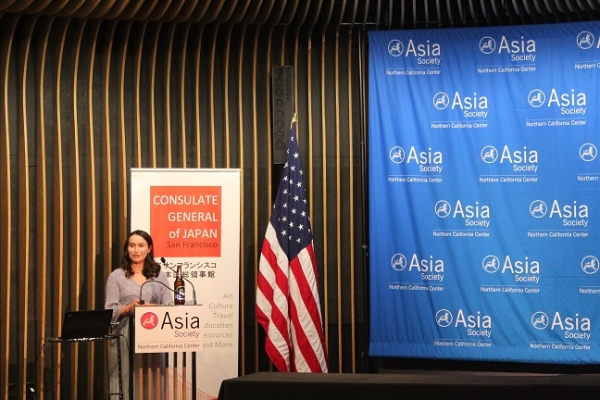
Where is `laptop`? laptop is located at coordinates (80, 322).